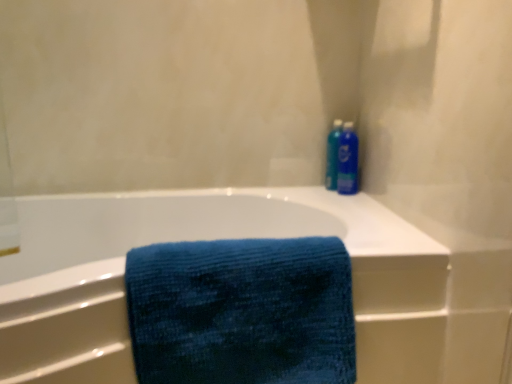
Question: Considering the relative sizes of blue fabric towel at center and blue textured towel at center in the image provided, is blue fabric towel at center thinner than blue textured towel at center?

Choices:
 (A) no
 (B) yes

Answer: (A)

Question: Can you confirm if blue fabric towel at center is bigger than blue textured towel at center?

Choices:
 (A) no
 (B) yes

Answer: (B)

Question: Considering the relative sizes of blue fabric towel at center and blue textured towel at center in the image provided, is blue fabric towel at center shorter than blue textured towel at center?

Choices:
 (A) no
 (B) yes

Answer: (A)

Question: Is blue fabric towel at center positioned with its back to blue textured towel at center?

Choices:
 (A) no
 (B) yes

Answer: (B)

Question: Is blue fabric towel at center completely or partially outside of blue textured towel at center?

Choices:
 (A) no
 (B) yes

Answer: (B)

Question: From a real-world perspective, is blue textured towel at center above or below blue fabric towel at center?

Choices:
 (A) below
 (B) above

Answer: (B)

Question: Considering their positions, is blue textured towel at center located in front of or behind blue fabric towel at center?

Choices:
 (A) behind
 (B) front

Answer: (A)

Question: Is blue textured towel at center inside the boundaries of blue fabric towel at center, or outside?

Choices:
 (A) outside
 (B) inside

Answer: (B)

Question: Considering the positions of blue textured towel at center and blue fabric towel at center in the image, is blue textured towel at center wider or thinner than blue fabric towel at center?

Choices:
 (A) wide
 (B) thin

Answer: (B)

Question: Is blue fabric towel at center wider or thinner than blue plastic bottle at upper right?

Choices:
 (A) wide
 (B) thin

Answer: (A)

Question: Considering their positions, is blue fabric towel at center located in front of or behind blue plastic bottle at upper right?

Choices:
 (A) behind
 (B) front

Answer: (B)

Question: Is point (414, 233) closer or farther from the camera than point (333, 140)?

Choices:
 (A) farther
 (B) closer

Answer: (B)

Question: Based on their positions, is blue fabric towel at center located to the left or right of blue plastic bottle at upper right?

Choices:
 (A) left
 (B) right

Answer: (A)

Question: Would you say blue fabric towel at center is to the left or to the right of blue glossy spray can at upper right in the picture?

Choices:
 (A) left
 (B) right

Answer: (A)

Question: From the image's perspective, is blue fabric towel at center positioned above or below blue glossy spray can at upper right?

Choices:
 (A) below
 (B) above

Answer: (A)